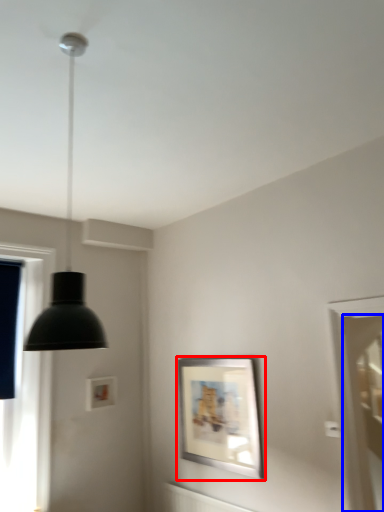
Question: Which object is closer to the camera taking this photo, picture frame (highlighted by a red box) or screen door (highlighted by a blue box)?

Choices:
 (A) picture frame
 (B) screen door

Answer: (A)